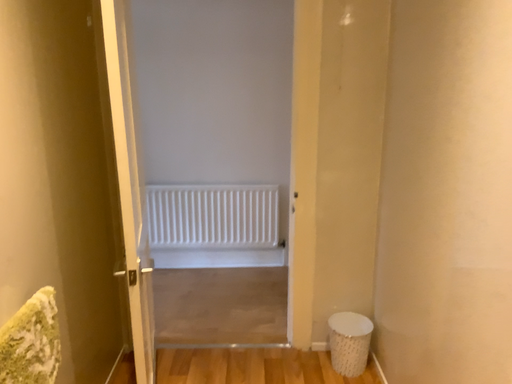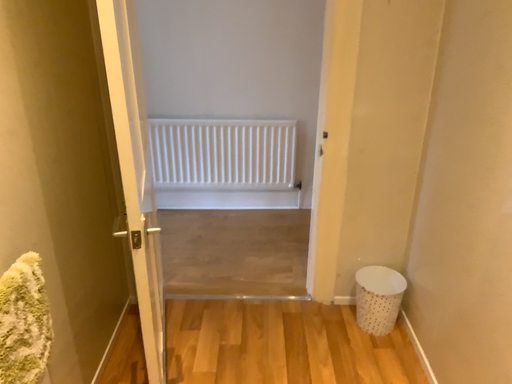
Question: Which way did the camera rotate in the video?

Choices:
 (A) rotated downward
 (B) rotated upward

Answer: (A)